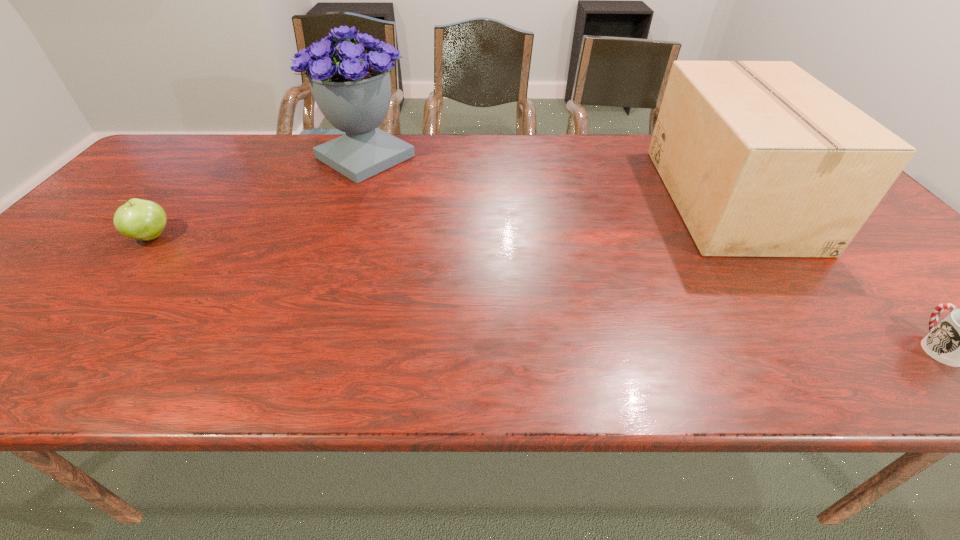
Image resolution: width=960 pixels, height=540 pixels. Find the location of `the third object from right to left`. the third object from right to left is located at coordinates (352, 89).

Where is `bouquet`? bouquet is located at coordinates (352, 89).

Identify the location of the second tallest object. (761, 159).

I want to click on apple, so click(x=138, y=219).

Locate an element on the screen. the leftmost object is located at coordinates (138, 219).

Locate an element on the screen. This screenshot has height=540, width=960. free location located on the left of the second object from left to right is located at coordinates [x=257, y=157].

Locate an element on the screen. This screenshot has width=960, height=540. free space located on the front of the box is located at coordinates (852, 369).

I want to click on free spot located on the back of the apple, so click(180, 204).

This screenshot has width=960, height=540. In order to click on bouquet at the far edge in this screenshot , I will do `click(352, 89)`.

Where is `box at the far edge`? The width and height of the screenshot is (960, 540). box at the far edge is located at coordinates (761, 159).